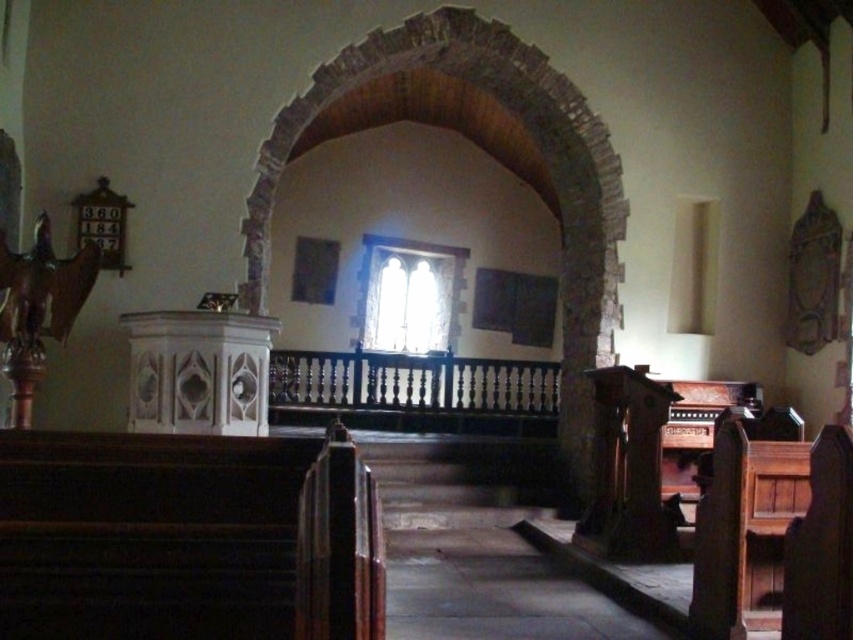
Based on the coordinates provided, which object in the church is marked by the point at (498, 161)?

The point at (498, 161) marks the brick textured archway at center.

You are standing at the entrance of the church and want to take a photo of the point at coordinates point (570, 108). If your camera has a maximum focus range of 25 feet, will it be able to focus on that point?

The distance of point (570, 108) from camera is 24.76 feet, which is within the camera maximum focus range of 25 feet. So yes, the camera can focus on that point.